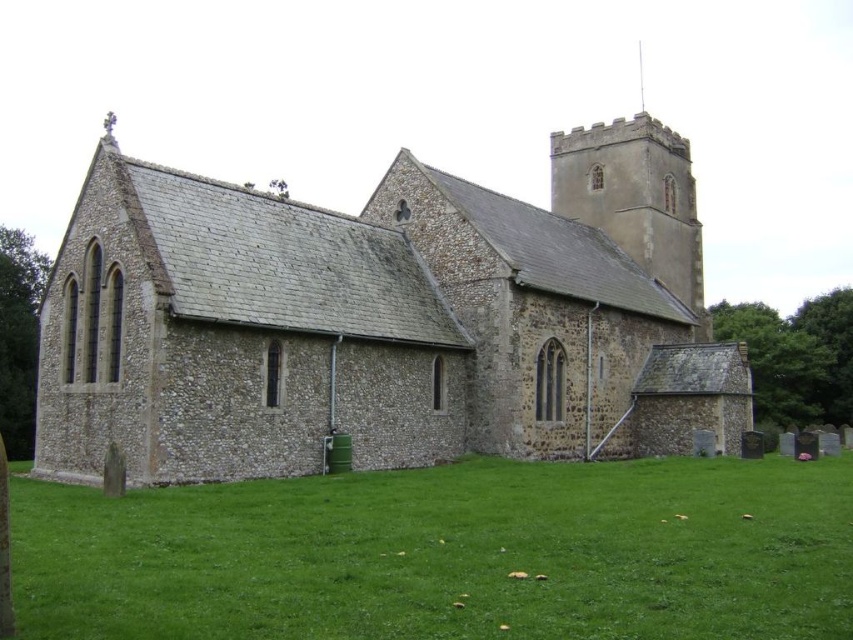
Between point (224, 451) and point (717, 557), which one is positioned in front?

Point (717, 557)

Consider the image. Which of these two, stone church at center or green grass at lower center, stands shorter?

green grass at lower center is shorter.

The width and height of the screenshot is (853, 640). In order to click on stone church at center in this screenshot , I will do `click(383, 320)`.

You are a GUI agent. You are given a task and a screenshot of the screen. Output one action in this format:
    pyautogui.click(x=<x>, y=<y>)
    Task: Click on the stone church at center
    This screenshot has height=640, width=853.
    Given the screenshot: What is the action you would take?
    pyautogui.click(x=383, y=320)